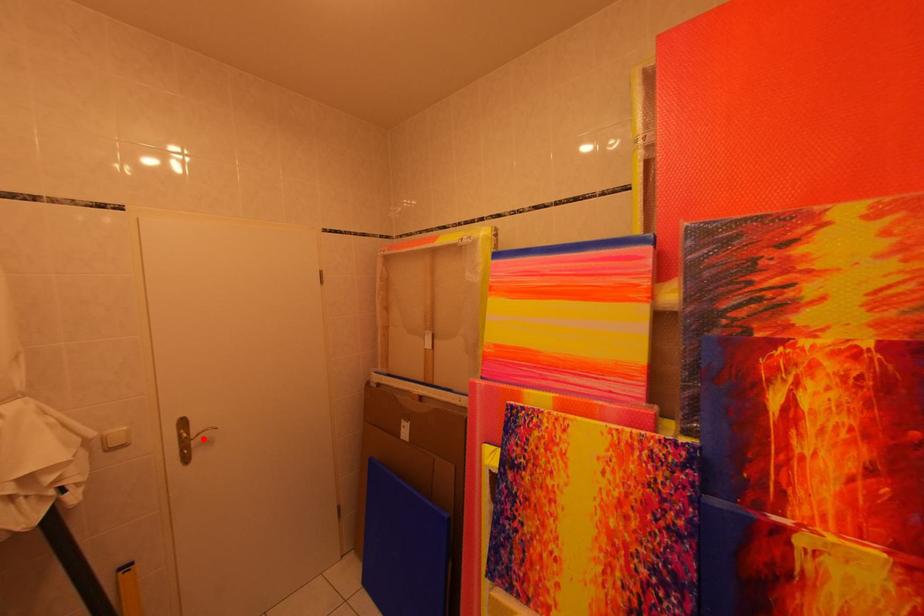
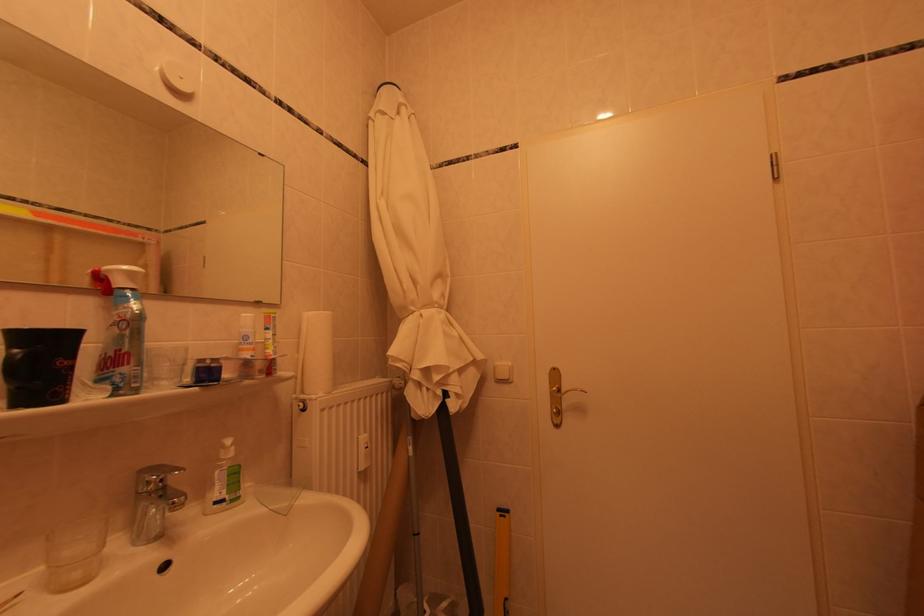
The point at the highlighted location is marked in the first image. Where is the corresponding point in the second image?

(572, 395)